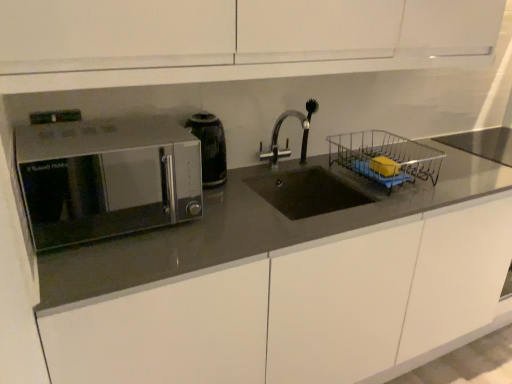
This screenshot has height=384, width=512. I want to click on unoccupied region to the right of satin silver microwave at left, so click(230, 225).